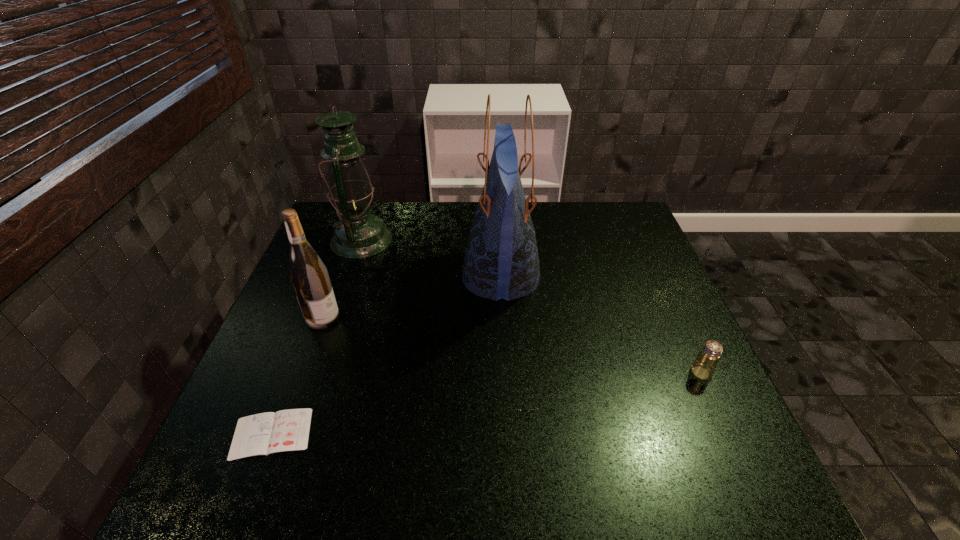
Where is `the fourth object from left to right`? Image resolution: width=960 pixels, height=540 pixels. the fourth object from left to right is located at coordinates (501, 261).

You are a GUI agent. You are given a task and a screenshot of the screen. Output one action in this format:
    pyautogui.click(x=<x>, y=<y>)
    Task: Click on the tallest object
    The height and width of the screenshot is (540, 960).
    Given the screenshot: What is the action you would take?
    pyautogui.click(x=501, y=261)

The image size is (960, 540). Find the location of `the second tallest object`. the second tallest object is located at coordinates (358, 234).

Where is `wine bottle`? This screenshot has width=960, height=540. wine bottle is located at coordinates pos(308,274).

This screenshot has height=540, width=960. I want to click on the rightmost object, so click(x=703, y=367).

Find the location of a particular element. This screenshot has width=960, height=540. saltshaker is located at coordinates (703, 367).

Where is `the nearest object`? The width and height of the screenshot is (960, 540). the nearest object is located at coordinates (287, 430).

This screenshot has height=540, width=960. I want to click on the shortest object, so click(287, 430).

Identify the location of vacant space located 0.230m on the left of the tallest object. The width and height of the screenshot is (960, 540). (380, 276).

You are a GUI agent. You are given a task and a screenshot of the screen. Output one action in this format:
    pyautogui.click(x=<x>, y=<y>)
    Task: Click on the free spot located on the front of the oil lamp
    Image resolution: width=960 pixels, height=540 pixels.
    Given the screenshot: What is the action you would take?
    pyautogui.click(x=344, y=291)